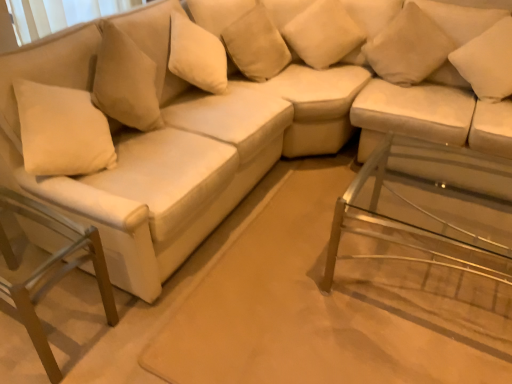
The image size is (512, 384). What do you see at coordinates (408, 47) in the screenshot?
I see `beige fabric pillow at upper right, placed as the third pillow when sorted from left to right` at bounding box center [408, 47].

This screenshot has width=512, height=384. What do you see at coordinates (487, 62) in the screenshot? I see `white soft cushion at upper right, which appears as the fourth pillow when viewed from the left` at bounding box center [487, 62].

The height and width of the screenshot is (384, 512). What do you see at coordinates (256, 44) in the screenshot?
I see `suede-like beige pillow at upper center, placed as the 4th pillow when sorted from right to left` at bounding box center [256, 44].

What is the approximate width of metallic silver swivel chair at lower left?

The width of metallic silver swivel chair at lower left is 27.09 inches.

Where is `beige fabric pillow at upper center, which ranks as the 2th pillow in left-to-right order`? The height and width of the screenshot is (384, 512). beige fabric pillow at upper center, which ranks as the 2th pillow in left-to-right order is located at coordinates (323, 33).

Based on the photo, which object is positioned more to the left, suede-like beige pillow at upper center, positioned as the 1th pillow in left-to-right order, or metallic silver swivel chair at lower left?

Positioned to the left is metallic silver swivel chair at lower left.

Is metallic silver swivel chair at lower left at the back of suede-like beige pillow at upper center, positioned as the 1th pillow in left-to-right order?

That's not correct — suede-like beige pillow at upper center, positioned as the 1th pillow in left-to-right order, is not looking away from metallic silver swivel chair at lower left.

Can you confirm if suede-like beige pillow at upper center, placed as the 4th pillow when sorted from right to left, is wider than metallic silver swivel chair at lower left?

No.

From the image's perspective, who appears lower, suede-like beige pillow at upper center, positioned as the 1th pillow in left-to-right order, or metallic silver swivel chair at lower left?

metallic silver swivel chair at lower left is shown below in the image.

From their relative heights in the image, would you say white soft cushion at upper right, arranged as the 1th pillow when viewed from the right, is taller or shorter than beige fabric pillow at upper right, placed as the third pillow when sorted from left to right?

Considering their sizes, white soft cushion at upper right, arranged as the 1th pillow when viewed from the right, has less height than beige fabric pillow at upper right, placed as the third pillow when sorted from left to right.

Is white soft cushion at upper right, arranged as the 1th pillow when viewed from the right, to the left or to the right of beige fabric pillow at upper right, acting as the second pillow starting from the right, in the image?

From the image, it's evident that white soft cushion at upper right, arranged as the 1th pillow when viewed from the right, is to the right of beige fabric pillow at upper right, acting as the second pillow starting from the right.

Which is farther from the camera, (466, 63) or (391, 64)?

The point (391, 64) is farther.

Is white soft cushion at upper right, which appears as the fourth pillow when viewed from the left, oriented away from beige fabric pillow at upper right, placed as the third pillow when sorted from left to right?

No.

Is beige fabric pillow at upper center, which ranks as the 2th pillow in left-to-right order, surrounding beige fabric pillow at upper right, placed as the third pillow when sorted from left to right?

No, beige fabric pillow at upper right, placed as the third pillow when sorted from left to right, is not a part of beige fabric pillow at upper center, which ranks as the 2th pillow in left-to-right order.

Image resolution: width=512 pixels, height=384 pixels. There is a beige fabric pillow at upper center, which ranks as the 2th pillow in left-to-right order. In order to click on the 2nd pillow below it (from a real-world perspective) in this screenshot , I will do `click(408, 47)`.

Does beige fabric pillow at upper center, which ranks as the 2th pillow in left-to-right order, have a greater height compared to beige fabric pillow at upper right, acting as the second pillow starting from the right?

Indeed, beige fabric pillow at upper center, which ranks as the 2th pillow in left-to-right order, has a greater height compared to beige fabric pillow at upper right, acting as the second pillow starting from the right.

Is white soft cushion at upper right, which appears as the fourth pillow when viewed from the left, positioned behind metallic silver swivel chair at lower left?

Yes, it is behind metallic silver swivel chair at lower left.

Between white soft cushion at upper right, arranged as the 1th pillow when viewed from the right, and metallic silver swivel chair at lower left, which one has larger width?

metallic silver swivel chair at lower left is wider.

From a real-world perspective, is white soft cushion at upper right, which appears as the fourth pillow when viewed from the left, beneath metallic silver swivel chair at lower left?

No.

The image size is (512, 384). I want to click on the 3rd pillow located above the metallic silver swivel chair at lower left (from a real-world perspective), so click(x=487, y=62).

Is beige fabric pillow at upper center, which ranks as the 2th pillow in left-to-right order, beside clear glass side table at lower right?

No, beige fabric pillow at upper center, which ranks as the 2th pillow in left-to-right order, is not making contact with clear glass side table at lower right.

From the image's perspective, would you say beige fabric pillow at upper center, which appears as the 3th pillow when viewed from the right, is shown under clear glass side table at lower right?

No, from the image's perspective, beige fabric pillow at upper center, which appears as the 3th pillow when viewed from the right, is not below clear glass side table at lower right.

Can you confirm if beige fabric pillow at upper center, which appears as the 3th pillow when viewed from the right, is taller than clear glass side table at lower right?

No, beige fabric pillow at upper center, which appears as the 3th pillow when viewed from the right, is not taller than clear glass side table at lower right.

Does beige fabric pillow at upper center, which ranks as the 2th pillow in left-to-right order, appear on the right side of white soft cushion at upper right, arranged as the 1th pillow when viewed from the right?

No, beige fabric pillow at upper center, which ranks as the 2th pillow in left-to-right order, is not to the right of white soft cushion at upper right, arranged as the 1th pillow when viewed from the right.

Choose the correct answer: Is beige fabric pillow at upper center, which ranks as the 2th pillow in left-to-right order, inside white soft cushion at upper right, arranged as the 1th pillow when viewed from the right, or outside it?

beige fabric pillow at upper center, which ranks as the 2th pillow in left-to-right order, is spatially situated outside white soft cushion at upper right, arranged as the 1th pillow when viewed from the right.

Is beige fabric pillow at upper center, which ranks as the 2th pillow in left-to-right order, turned away from white soft cushion at upper right, arranged as the 1th pillow when viewed from the right?

beige fabric pillow at upper center, which ranks as the 2th pillow in left-to-right order, does not have its back to white soft cushion at upper right, arranged as the 1th pillow when viewed from the right.

Is point (96, 276) closer or farther from the camera than point (320, 12)?

Point (96, 276) is closer to the camera than point (320, 12).

Looking at this image, from the image's perspective, which one is positioned lower, metallic silver swivel chair at lower left or beige fabric pillow at upper center, which ranks as the 2th pillow in left-to-right order?

metallic silver swivel chair at lower left appears lower in the image.

Considering the relative sizes of metallic silver swivel chair at lower left and beige fabric pillow at upper center, which appears as the 3th pillow when viewed from the right, in the image provided, is metallic silver swivel chair at lower left taller than beige fabric pillow at upper center, which appears as the 3th pillow when viewed from the right,?

Yes, metallic silver swivel chair at lower left is taller than beige fabric pillow at upper center, which appears as the 3th pillow when viewed from the right.

At what (x,y) coordinates should I click in order to perform the action: click on the 1st pillow above the metallic silver swivel chair at lower left (from a real-world perspective). Please return your answer as a coordinate pair (x, y). The height and width of the screenshot is (384, 512). Looking at the image, I should click on (256, 44).

You are a GUI agent. You are given a task and a screenshot of the screen. Output one action in this format:
    pyautogui.click(x=<x>, y=<y>)
    Task: Click on the 1st pillow behind when counting from the white soft cushion at upper right, which appears as the fourth pillow when viewed from the left
    This screenshot has width=512, height=384.
    Given the screenshot: What is the action you would take?
    pyautogui.click(x=408, y=47)

When comparing their distances from beige fabric pillow at upper center, which appears as the 3th pillow when viewed from the right, does metallic silver swivel chair at lower left or beige fabric pillow at upper right, placed as the third pillow when sorted from left to right, seem further?

Based on the image, metallic silver swivel chair at lower left appears to be further to beige fabric pillow at upper center, which appears as the 3th pillow when viewed from the right.

Considering their positions, is white soft cushion at upper right, arranged as the 1th pillow when viewed from the right, positioned closer to beige fabric pillow at upper right, placed as the third pillow when sorted from left to right, than beige fabric pillow at upper center, which appears as the 3th pillow when viewed from the right?

The object closer to beige fabric pillow at upper right, placed as the third pillow when sorted from left to right, is white soft cushion at upper right, arranged as the 1th pillow when viewed from the right.

Estimate the real-world distances between objects in this image. Which object is further from suede-like beige pillow at upper center, placed as the 4th pillow when sorted from right to left, beige fabric pillow at upper right, placed as the third pillow when sorted from left to right, or white soft cushion at upper right, arranged as the 1th pillow when viewed from the right?

Based on the image, white soft cushion at upper right, arranged as the 1th pillow when viewed from the right, appears to be further to suede-like beige pillow at upper center, placed as the 4th pillow when sorted from right to left.

Considering their positions, is beige fabric pillow at upper center, which appears as the 3th pillow when viewed from the right, positioned further to white soft cushion at upper right, which appears as the fourth pillow when viewed from the left, than suede-like beige pillow at upper center, positioned as the 1th pillow in left-to-right order?

Based on the image, suede-like beige pillow at upper center, positioned as the 1th pillow in left-to-right order, appears to be further to white soft cushion at upper right, which appears as the fourth pillow when viewed from the left.

Which object lies further to the anchor point metallic silver swivel chair at lower left, white soft cushion at upper right, arranged as the 1th pillow when viewed from the right, or beige fabric pillow at upper center, which appears as the 3th pillow when viewed from the right?

white soft cushion at upper right, arranged as the 1th pillow when viewed from the right.

Considering their positions, is suede-like beige pillow at upper center, placed as the 4th pillow when sorted from right to left, positioned further to metallic silver swivel chair at lower left than beige fabric pillow at upper right, acting as the second pillow starting from the right?

Among the two, beige fabric pillow at upper right, acting as the second pillow starting from the right, is located further to metallic silver swivel chair at lower left.

Based on the photo, when comparing their distances from metallic silver swivel chair at lower left, does beige fabric pillow at upper right, placed as the third pillow when sorted from left to right, or beige fabric pillow at upper center, which ranks as the 2th pillow in left-to-right order, seem closer?

beige fabric pillow at upper center, which ranks as the 2th pillow in left-to-right order, is positioned closer to the anchor metallic silver swivel chair at lower left.

Looking at the image, which one is located closer to white soft cushion at upper right, arranged as the 1th pillow when viewed from the right, suede-like beige pillow at upper center, positioned as the 1th pillow in left-to-right order, or metallic silver swivel chair at lower left?

Based on the image, suede-like beige pillow at upper center, positioned as the 1th pillow in left-to-right order, appears to be nearer to white soft cushion at upper right, arranged as the 1th pillow when viewed from the right.

The image size is (512, 384). Identify the location of side table between metallic silver swivel chair at lower left and white soft cushion at upper right, arranged as the 1th pillow when viewed from the right. (424, 227).

Find the location of a particular element. The height and width of the screenshot is (384, 512). pillow between beige fabric pillow at upper center, which ranks as the 2th pillow in left-to-right order, and white soft cushion at upper right, arranged as the 1th pillow when viewed from the right, in the horizontal direction is located at coordinates (408, 47).

Locate an element on the screen. side table located between suede-like beige pillow at upper center, positioned as the 1th pillow in left-to-right order, and white soft cushion at upper right, which appears as the fourth pillow when viewed from the left, in the left-right direction is located at coordinates (424, 227).

Locate an element on the screen. The width and height of the screenshot is (512, 384). pillow between beige fabric pillow at upper right, acting as the second pillow starting from the right, and clear glass side table at lower right from top to bottom is located at coordinates (487, 62).